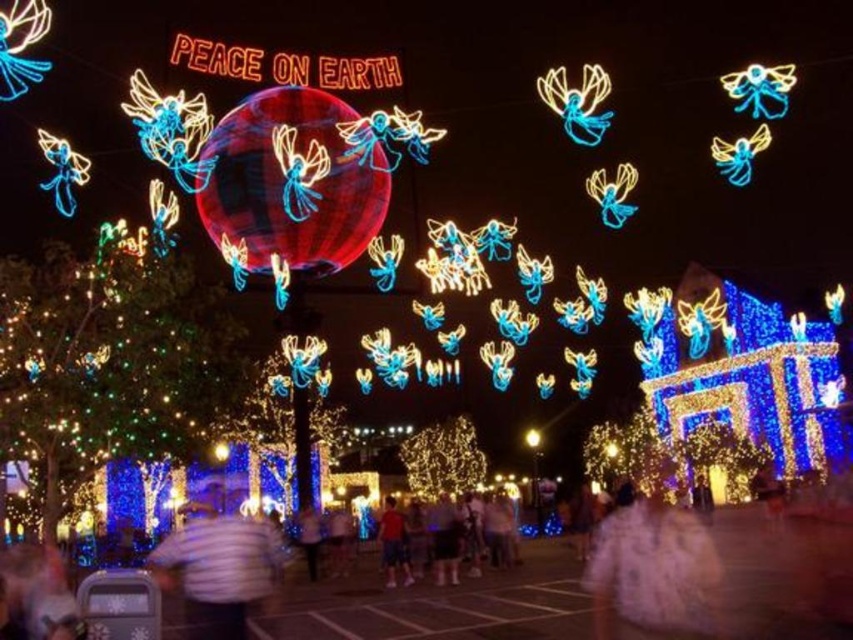
You are attending a holiday event and notice two shirts in the crowd. The white striped shirt at center and the matte red shirt at center. Which one appears larger to you?

The white striped shirt at center is bigger than the matte red shirt at center, so the white striped shirt at center appears larger.

You are standing in the festive nighttime scene and want to move from the point at coordinates point (252,589) to the point at coordinates point (389,536). Which direction should you face to walk towards the second point?

You should face towards the direction of the building decorated with blue lights in the background since point (252,589) is in front of point (389,536), meaning the second point is behind the first one relative to the viewer.

You are at a holiday light display and see two shirts at the center of the image. The white striped shirt at center and the matte red shirt at center. Which one is positioned to the left?

The white striped shirt at center is to the left of the matte red shirt at center.